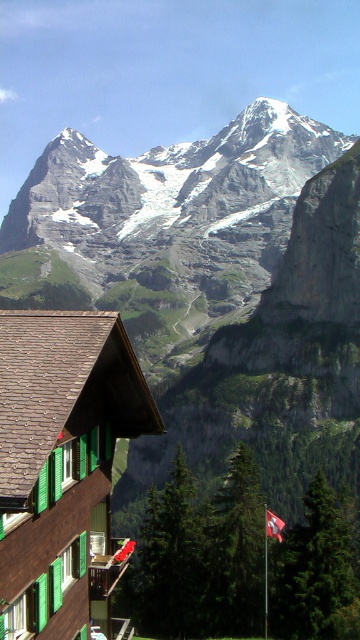
You are an architect designing a new building that needs to align with the proportions of the existing structures in the image. Given the snowy granite mountain range at upper center and the red fabric flag at lower right, which object should you consider in terms of width for proper scaling?

The snowy granite mountain range at upper center might be wider than the red fabric flag at lower right, so you should consider the width of the snowy granite mountain range at upper center for proper scaling.

You are standing at the base of the mountain looking towards the brown shingle chalet at lower left and the red fabric flag at lower right. Which object is positioned higher in the scene?

The brown shingle chalet at lower left is positioned higher than the red fabric flag at lower right according to the description.

You are standing in front of the traditional wooden building and want to take a photo that includes both the snowy granite mountain range at upper center and the red fabric flag at lower right. Which object should you focus on first to ensure both are in the frame?

The snowy granite mountain range at upper center is taller than the red fabric flag at lower right, so you should focus on the snowy granite mountain range at upper center first to ensure both are in the frame.